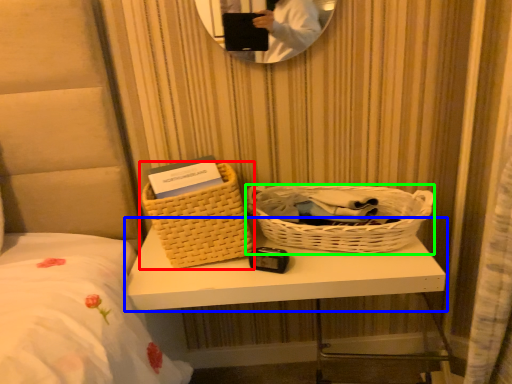
Question: Based on their relative distances, which object is nearer to picnic basket (highlighted by a red box)? Choose from table (highlighted by a blue box) and picnic basket (highlighted by a green box).

Choices:
 (A) table
 (B) picnic basket

Answer: (A)